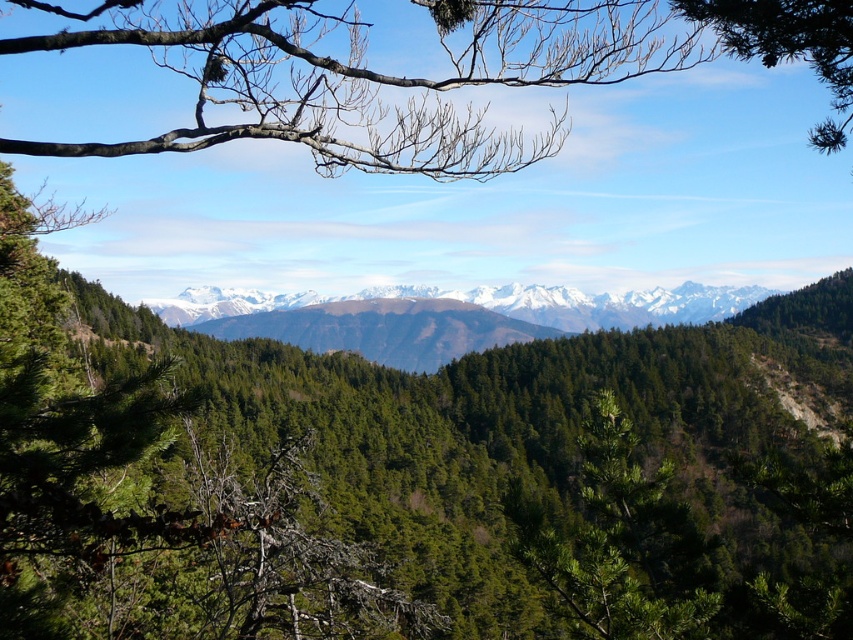
Question: Which point is closer to the camera?

Choices:
 (A) bare branches at upper center
 (B) green matte tree at center

Answer: (A)

Question: Is bare branches at upper center further to the viewer compared to snowy rocky mountain range at center?

Choices:
 (A) yes
 (B) no

Answer: (B)

Question: Is the position of bare branches at upper center less distant than that of green matte tree at center?

Choices:
 (A) no
 (B) yes

Answer: (B)

Question: Which of the following is the closest to the observer?

Choices:
 (A) bare branches at upper center
 (B) green matte tree at center
 (C) snowy rocky mountain range at center

Answer: (A)

Question: Does green matte tree at center have a greater width compared to snowy rocky mountain range at center?

Choices:
 (A) yes
 (B) no

Answer: (B)

Question: Which point is farther from the camera taking this photo?

Choices:
 (A) (758, 300)
 (B) (595, 516)
 (C) (305, 140)

Answer: (A)